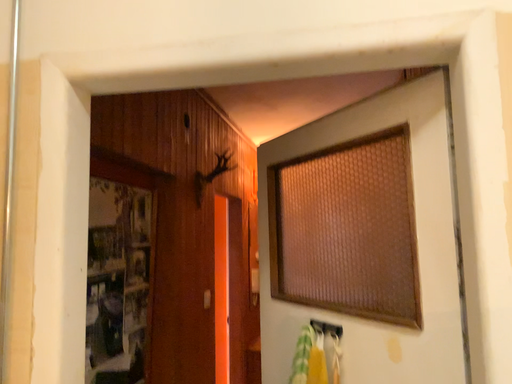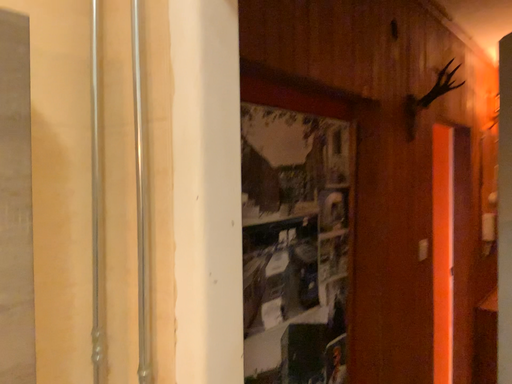
Question: Which way did the camera rotate in the video?

Choices:
 (A) rotated left
 (B) rotated right

Answer: (A)